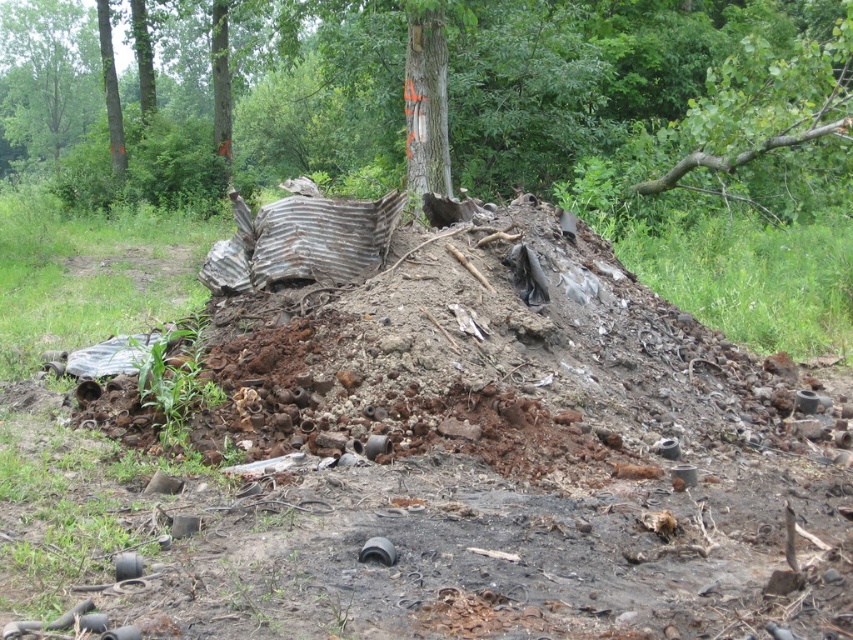
You are standing at the origin point of the coordinate system. You want to walk to the smooth bark tree at center. Which direction should you go?

The smooth bark tree at center is located at coordinate point (448, 99), so you should walk northeast to reach it.